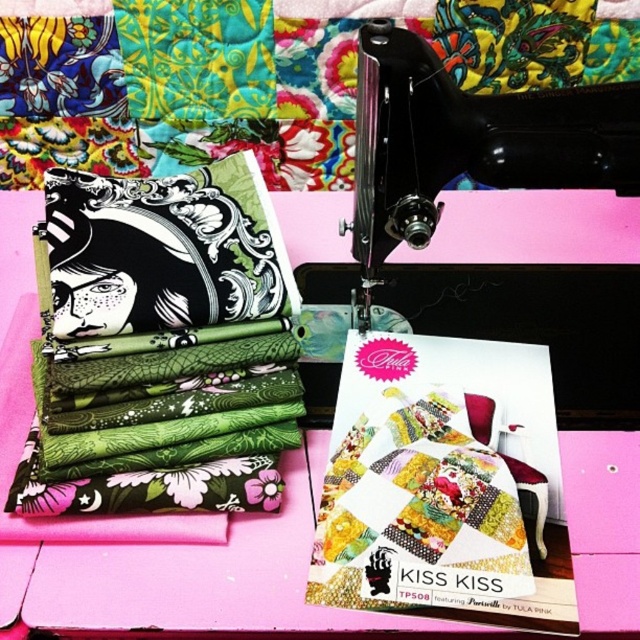
Between pink wood table at center and black plastic sewing machine at center, which one is positioned higher?

black plastic sewing machine at center is higher up.

Is pink wood table at center bigger than black plastic sewing machine at center?

Correct, pink wood table at center is larger in size than black plastic sewing machine at center.

Who is more distant from viewer, [332,611] or [636,116]?

Positioned behind is point [636,116].

Locate an element on the screen. pink wood table at center is located at coordinates (150, 522).